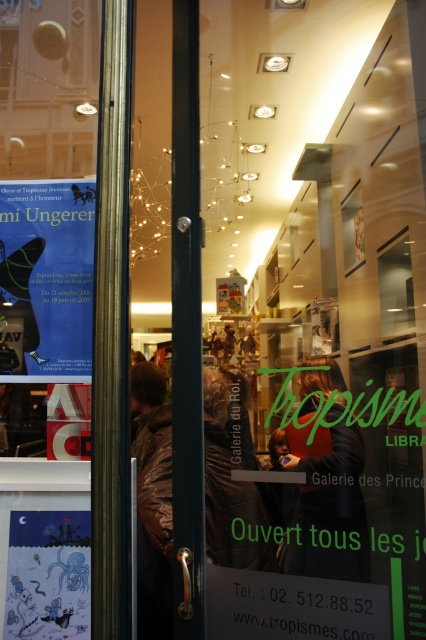
Question: Which object is the closest to the red fabric person at center?

Choices:
 (A) matte paper poster at upper left
 (B) brown leather jacket at center

Answer: (B)

Question: Which point is closer to the camera?

Choices:
 (A) (224, 563)
 (B) (311, 493)
 (C) (40, 380)

Answer: (B)

Question: Which of these objects is positioned farthest from the brown leather jacket at center?

Choices:
 (A) red fabric person at center
 (B) matte paper poster at upper left

Answer: (B)

Question: Is matte paper poster at upper left thinner than red fabric person at center?

Choices:
 (A) yes
 (B) no

Answer: (B)

Question: Is matte paper poster at upper left in front of matte blue octopus at lower left?

Choices:
 (A) no
 (B) yes

Answer: (A)

Question: Observing the image, what is the correct spatial positioning of red fabric person at center in reference to matte blue octopus at lower left?

Choices:
 (A) right
 (B) left

Answer: (A)